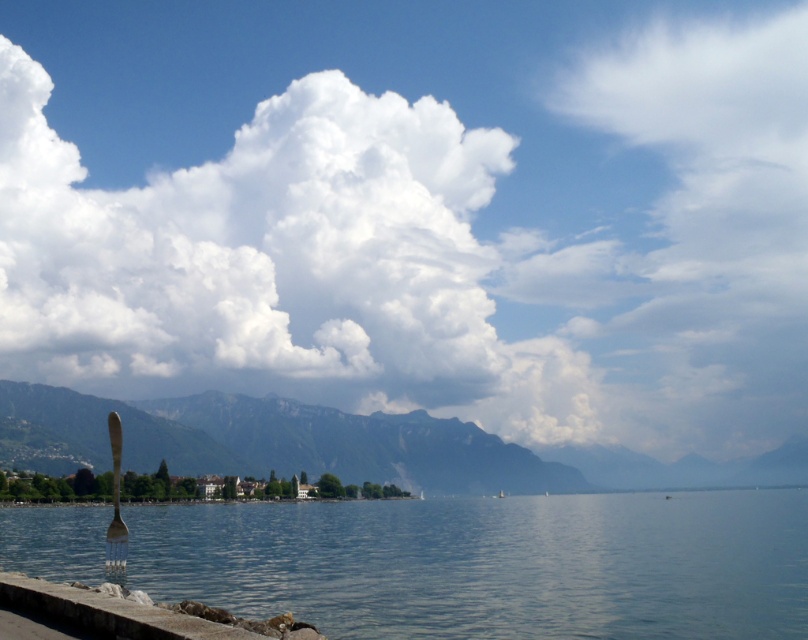
Question: Which of these objects is positioned closest to the matte gray mountain at center?

Choices:
 (A) gray stone ledge at lower left
 (B) white fluffy cloud at upper center

Answer: (B)

Question: Is white fluffy cloud at upper center positioned at the back of gray stone ledge at lower left?

Choices:
 (A) no
 (B) yes

Answer: (B)

Question: Is white fluffy cloud at upper center below gray stone ledge at lower left?

Choices:
 (A) no
 (B) yes

Answer: (A)

Question: Which of the following is the farthest from the observer?

Choices:
 (A) (482, 477)
 (B) (508, 532)
 (C) (356, 410)
 (D) (49, 621)

Answer: (A)

Question: Which point is closer to the camera?

Choices:
 (A) tap(142, 307)
 (B) tap(47, 588)
 (C) tap(491, 451)

Answer: (B)

Question: Does white fluffy cloud at upper center appear over matte gray mountain at center?

Choices:
 (A) no
 (B) yes

Answer: (B)